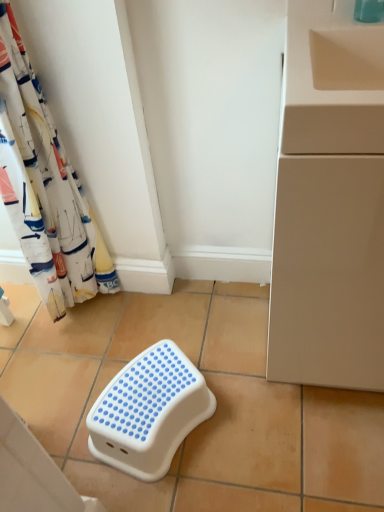
Where is `vacant space in between white fabric curtain at left and white plastic step stool at center`? The image size is (384, 512). vacant space in between white fabric curtain at left and white plastic step stool at center is located at coordinates (117, 343).